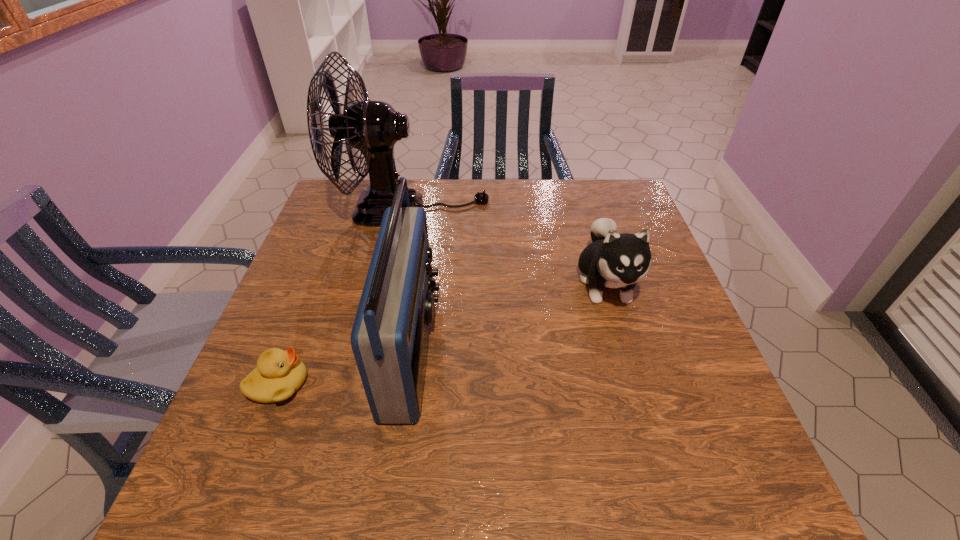
Locate an element on the screen. the farthest object is located at coordinates (373, 127).

Identify the location of fan. (373, 127).

What are the coordinates of `radio receiver` in the screenshot? It's located at (389, 338).

In order to click on the rightmost object in this screenshot , I will do `click(613, 260)`.

This screenshot has width=960, height=540. Find the location of `the third tallest object`. the third tallest object is located at coordinates (613, 260).

Locate an element on the screen. the shortest object is located at coordinates (279, 374).

At what (x,y) coordinates should I click in order to perform the action: click on vacant position located in front of the farthest object, indicating the direction of air flow. Please return your answer as a coordinate pair (x, y). Looking at the image, I should click on (606, 210).

Identify the location of vacant space situated on the front panel of the radio receiver. Image resolution: width=960 pixels, height=540 pixels. (520, 349).

This screenshot has width=960, height=540. In order to click on vacant region located 0.160m at the face of the second shortest object in this screenshot , I will do `click(636, 386)`.

Where is `free space located 0.330m on the beak of the shortest object`? free space located 0.330m on the beak of the shortest object is located at coordinates (471, 384).